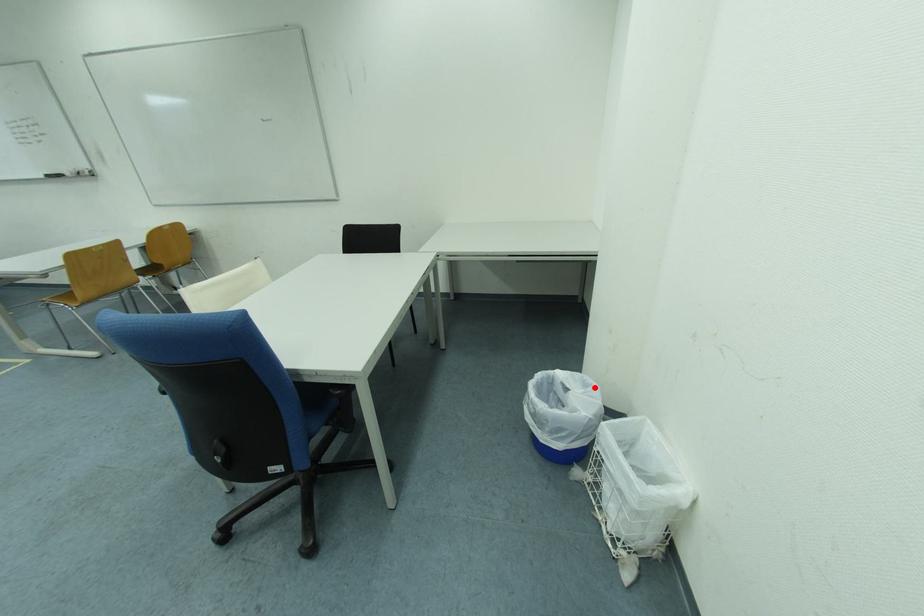
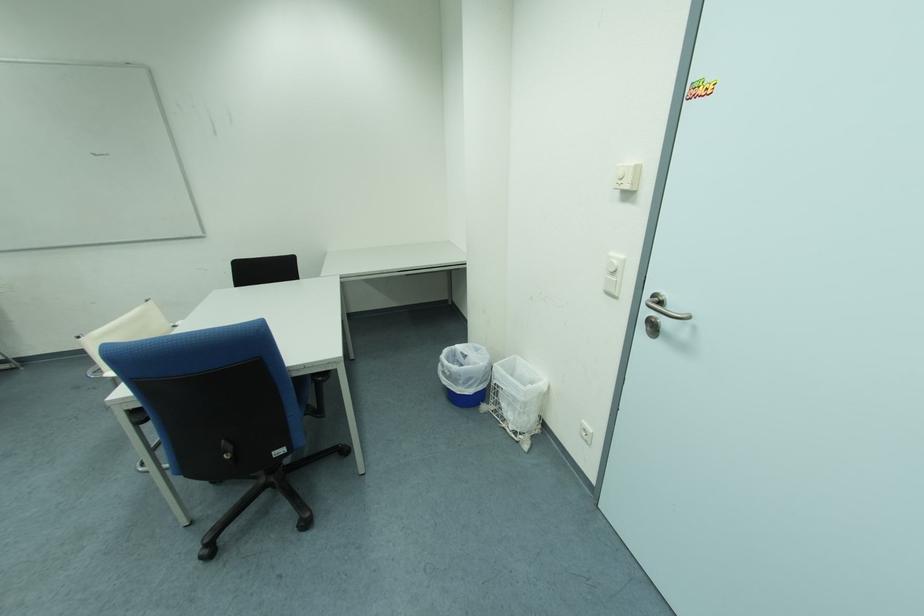
Question: I am providing you with two images of the same scene from different viewpoints. A red point is marked on the first image. Is the red point's position out of view in image 2?

Choices:
 (A) Yes
 (B) No

Answer: (B)